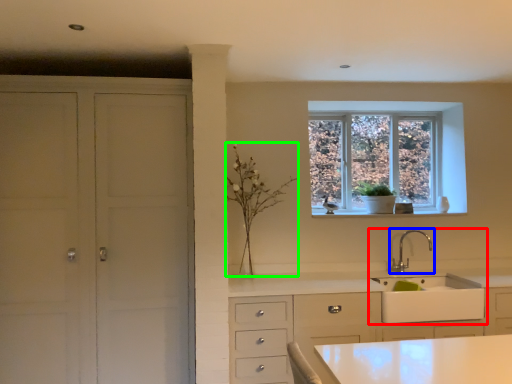
Question: Estimate the real-world distances between objects in this image. Which object is closer to sink (highlighted by a red box), tap (highlighted by a blue box) or plant (highlighted by a green box)?

Choices:
 (A) tap
 (B) plant

Answer: (A)